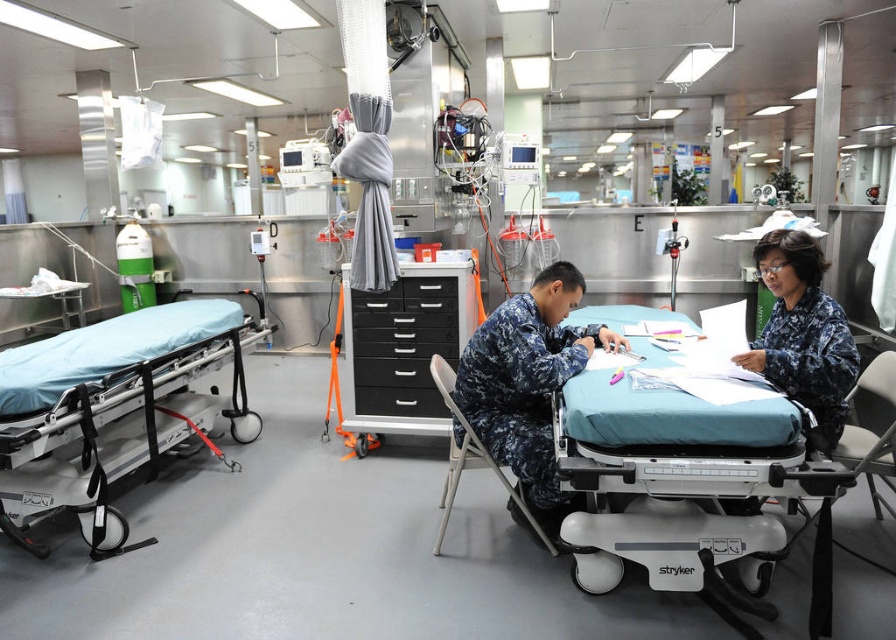
Question: Which object is the farthest from the camouflage fabric robe at right?

Choices:
 (A) camouflage fabric uniform at center
 (B) blue fabric-covered stretcher at left

Answer: (B)

Question: Which of these objects is positioned closest to the teal fabric stretcher at center?

Choices:
 (A) gray fabric curtain at center
 (B) black plastic drawers at center

Answer: (B)

Question: Is the position of blue fabric-covered stretcher at left more distant than that of camouflage fabric robe at right?

Choices:
 (A) no
 (B) yes

Answer: (B)

Question: Which object is the closest to the gray fabric curtain at center?

Choices:
 (A) blue fabric-covered stretcher at left
 (B) camouflage fabric robe at right
 (C) black plastic drawers at center
 (D) teal fabric stretcher at center

Answer: (C)

Question: Can you confirm if blue fabric-covered stretcher at left is positioned below black plastic drawers at center?

Choices:
 (A) no
 (B) yes

Answer: (B)

Question: Can you confirm if camouflage fabric uniform at center is smaller than black plastic drawers at center?

Choices:
 (A) yes
 (B) no

Answer: (B)